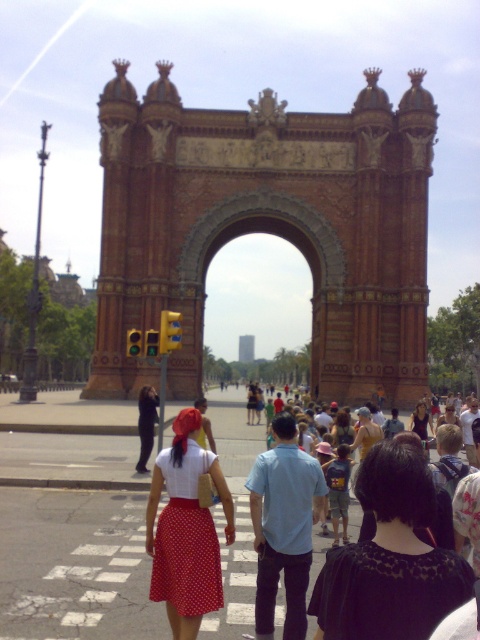
Question: Is black lace dress at center to the left of polka dot skirt at center from the viewer's perspective?

Choices:
 (A) yes
 (B) no

Answer: (B)

Question: Which of the following is the closest to the observer?

Choices:
 (A) (287, 529)
 (B) (192, 557)
 (C) (146, 433)

Answer: (B)

Question: Which of these objects is positioned farthest from the red fabric skirt at center?

Choices:
 (A) light blue shirt at center
 (B) dark blue jeans at center
 (C) black lace dress at center

Answer: (C)

Question: Estimate the real-world distances between objects in this image. Which object is farther from the polka dot skirt at center?

Choices:
 (A) dark blue jeans at center
 (B) red fabric skirt at center
 (C) black lace dress at center

Answer: (C)

Question: Can you confirm if polka dot skirt at center is smaller than dark blue jeans at center?

Choices:
 (A) yes
 (B) no

Answer: (B)

Question: From the image, what is the correct spatial relationship of light blue shirt at center in relation to dark blue jeans at center?

Choices:
 (A) above
 (B) below

Answer: (B)